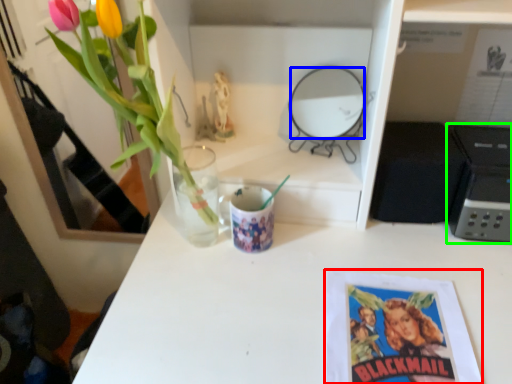
Question: Which object is positioned closest to book cover (highlighted by a red box)? Select from mirror (highlighted by a blue box) and appliance (highlighted by a green box).

Choices:
 (A) mirror
 (B) appliance

Answer: (B)